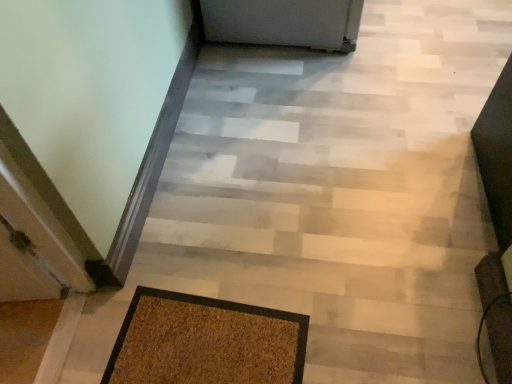
Locate an element on the screen. The image size is (512, 384). free point behind brown textured mat at lower center is located at coordinates (210, 277).